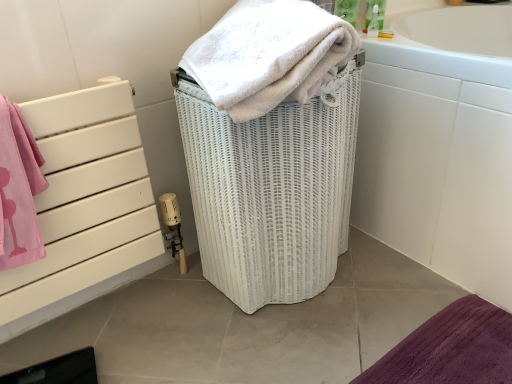
Where is `free location in front of white wicker basket at center`? free location in front of white wicker basket at center is located at coordinates (295, 341).